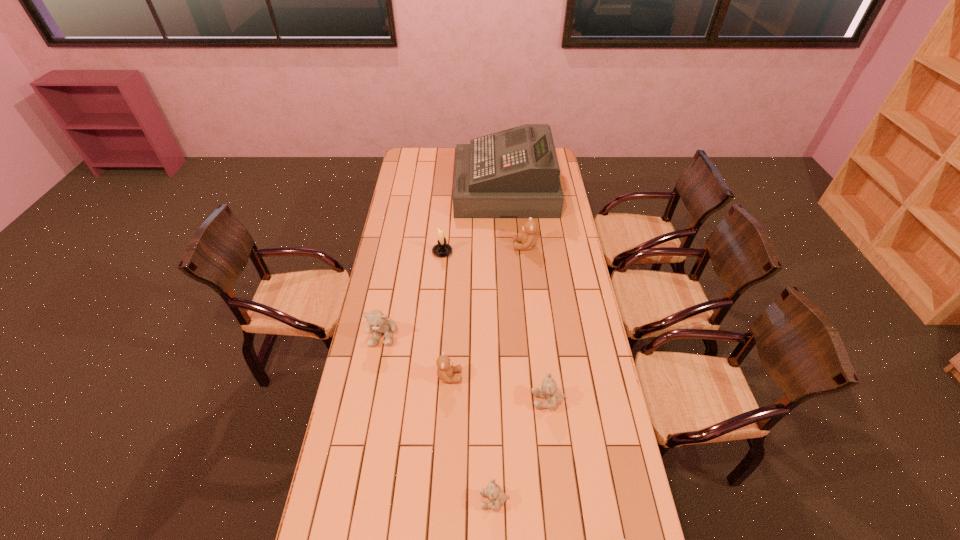
At what (x,y) coordinates should I click in order to perform the action: click on free space between the fifth farthest object and the farthest brown teddy bear. Please return your answer as a coordinate pair (x, y). The width and height of the screenshot is (960, 540). Looking at the image, I should click on coord(487,311).

In order to click on free spot between the second brown teddy bear from left to right and the fifth farthest object in this screenshot , I will do `click(487, 311)`.

Image resolution: width=960 pixels, height=540 pixels. Identify the location of free spot between the fourth teddy bear from right to left and the farthest object. (500, 344).

Where is `free space between the leftmost gray teddy bear and the third farthest teddy bear`? This screenshot has height=540, width=960. free space between the leftmost gray teddy bear and the third farthest teddy bear is located at coordinates (416, 355).

This screenshot has width=960, height=540. Find the location of `vacant space that's between the farthest brown teddy bear and the second smallest gray teddy bear`. vacant space that's between the farthest brown teddy bear and the second smallest gray teddy bear is located at coordinates (537, 323).

The height and width of the screenshot is (540, 960). Find the location of `vacant space in between the biggest brown teddy bear and the rightmost gray teddy bear`. vacant space in between the biggest brown teddy bear and the rightmost gray teddy bear is located at coordinates (537, 323).

Image resolution: width=960 pixels, height=540 pixels. Identify the location of object that is the third nearest to the candle holder. (376, 320).

The width and height of the screenshot is (960, 540). I want to click on object that is the fourth closest to the second smallest gray teddy bear, so click(376, 320).

Where is `teddy bear that stands as the closest to the second biggest brown teddy bear`? This screenshot has height=540, width=960. teddy bear that stands as the closest to the second biggest brown teddy bear is located at coordinates (376, 320).

Where is `teddy bear that stands as the closest to the biggest brown teddy bear`? Image resolution: width=960 pixels, height=540 pixels. teddy bear that stands as the closest to the biggest brown teddy bear is located at coordinates click(376, 320).